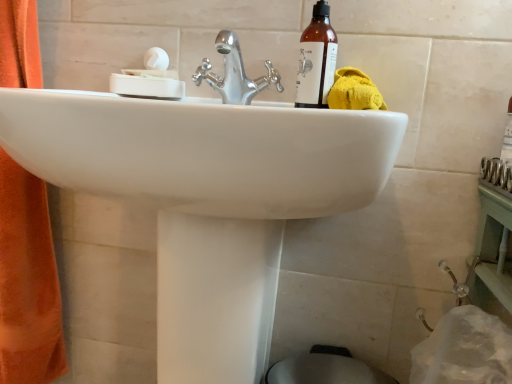
Question: Considering the relative sizes of white matte soap dish at upper left and brown glass bottle at upper right in the image provided, is white matte soap dish at upper left shorter than brown glass bottle at upper right?

Choices:
 (A) no
 (B) yes

Answer: (B)

Question: Considering the relative sizes of white matte soap dish at upper left and brown glass bottle at upper right in the image provided, is white matte soap dish at upper left smaller than brown glass bottle at upper right?

Choices:
 (A) yes
 (B) no

Answer: (B)

Question: Does white matte soap dish at upper left have a greater height compared to brown glass bottle at upper right?

Choices:
 (A) no
 (B) yes

Answer: (A)

Question: Is brown glass bottle at upper right surrounded by white matte soap dish at upper left?

Choices:
 (A) yes
 (B) no

Answer: (B)

Question: Can you confirm if white matte soap dish at upper left is wider than brown glass bottle at upper right?

Choices:
 (A) no
 (B) yes

Answer: (B)

Question: Is white matte soap dish at upper left not inside brown glass bottle at upper right?

Choices:
 (A) no
 (B) yes

Answer: (B)

Question: Can you confirm if brown glass bottle at upper right is shorter than white matte soap dish at upper left?

Choices:
 (A) no
 (B) yes

Answer: (A)

Question: Is white matte soap dish at upper left at the back of brown glass bottle at upper right?

Choices:
 (A) no
 (B) yes

Answer: (A)

Question: From a real-world perspective, is brown glass bottle at upper right located beneath white matte soap dish at upper left?

Choices:
 (A) no
 (B) yes

Answer: (A)

Question: Can you confirm if brown glass bottle at upper right is taller than white matte soap dish at upper left?

Choices:
 (A) no
 (B) yes

Answer: (B)

Question: Is brown glass bottle at upper right at the right side of white matte soap dish at upper left?

Choices:
 (A) yes
 (B) no

Answer: (A)

Question: From a real-world perspective, is brown glass bottle at upper right positioned over white matte soap dish at upper left based on gravity?

Choices:
 (A) no
 (B) yes

Answer: (B)

Question: Is yellow fabric towel at upper right in contact with brown glass bottle at upper right?

Choices:
 (A) yes
 (B) no

Answer: (A)